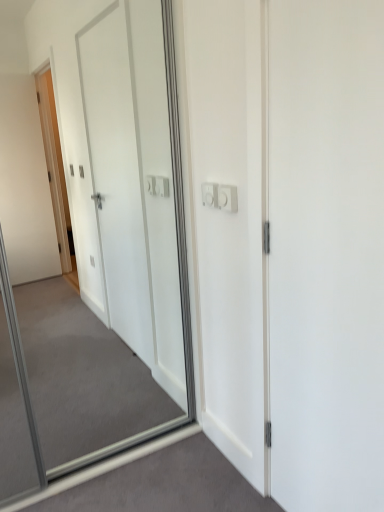
Question: Should I look upward or downward to see white matte door at center?

Choices:
 (A) down
 (B) up

Answer: (A)